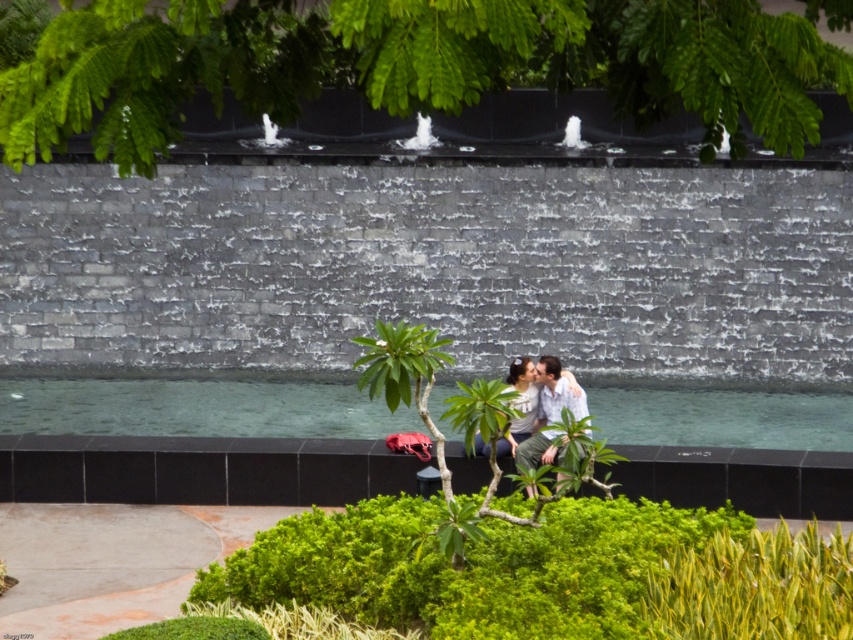
You are observing the scene from the camera perspective. There are two points marked in the image, point (795, 28) and point (521, 436). Which point is closer to you?

Point (795, 28) is closer to the camera than point (521, 436).

You are a photographer standing at the edge of the garden. You want to take a photo of the matte white shirt at center and the green leafy tree at upper center. If your camera has a depth of field that can focus on objects within 5 meters of each other, will both subjects be in focus?

The green leafy tree at upper center is 7.62 meters away from the matte white shirt at center. Since the distance between them exceeds the 5 meters depth of field range, they cannot both be in focus simultaneously.

You are an artist sketching the scene. You notice the green leafy tree at upper center and the matte white shirt at center. Which object has a narrower width in the image?

The green leafy tree at upper center is thinner than the matte white shirt at center, so the green leafy tree at upper center has a narrower width.